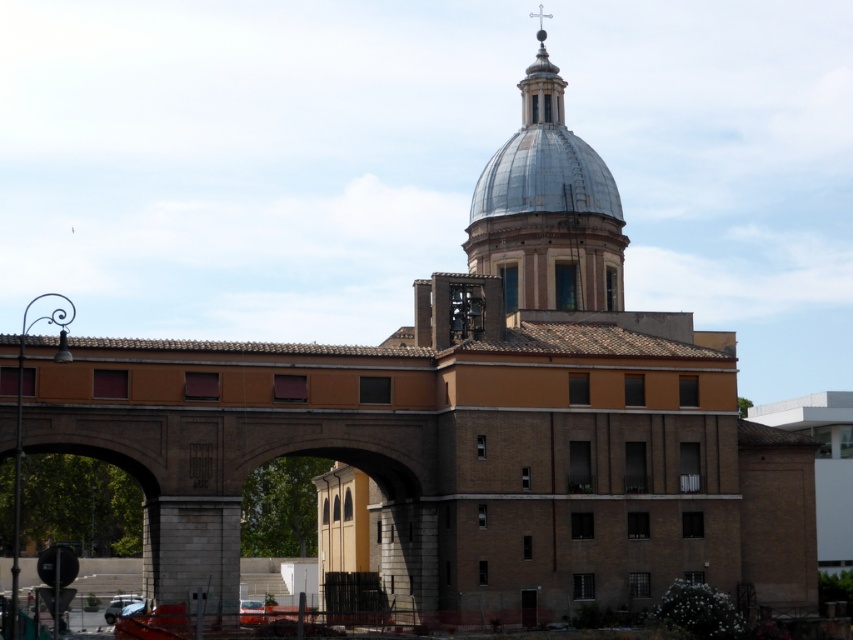
Question: Is shiny silver dome at upper center wider than shiny metallic dome at upper center?

Choices:
 (A) no
 (B) yes

Answer: (B)

Question: Among these points, which one is farthest from the camera?

Choices:
 (A) (532, 108)
 (B) (512, 204)

Answer: (A)

Question: Which of the following is the farthest from the observer?

Choices:
 (A) shiny silver dome at upper center
 (B) shiny metallic dome at upper center

Answer: (B)

Question: Does shiny silver dome at upper center have a greater width compared to shiny metallic dome at upper center?

Choices:
 (A) no
 (B) yes

Answer: (B)

Question: Does shiny silver dome at upper center appear on the left side of shiny metallic dome at upper center?

Choices:
 (A) no
 (B) yes

Answer: (B)